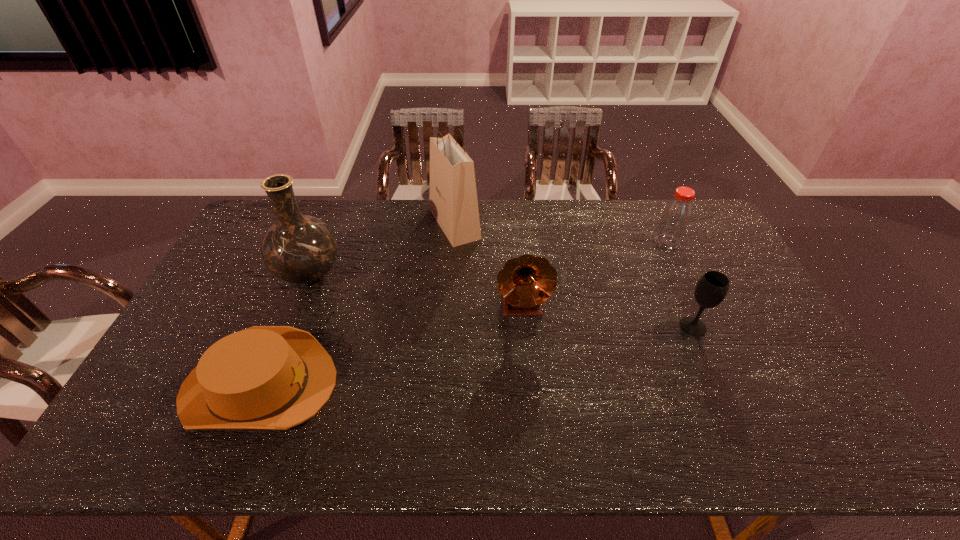
You are a GUI agent. You are given a task and a screenshot of the screen. Output one action in this format:
    pyautogui.click(x=<x>, y=<y>)
    Task: Click on the free location located 0.170m on the back of the bottle
    The width and height of the screenshot is (960, 540).
    Given the screenshot: What is the action you would take?
    pyautogui.click(x=650, y=207)

Identify the location of free space located 0.320m on the back of the wineglass. (658, 247).

Find the location of a particular element. Image resolution: width=960 pixels, height=540 pixels. vacant space located 0.290m on the front-facing side of the shortest object is located at coordinates (448, 385).

Where is `shopping bag present at the far edge`? The image size is (960, 540). shopping bag present at the far edge is located at coordinates (453, 202).

Find the location of a particular element. bottle located in the far edge section of the desktop is located at coordinates (675, 219).

This screenshot has width=960, height=540. I want to click on object located in the near edge section of the desktop, so click(264, 377).

The image size is (960, 540). I want to click on object that is at the left edge, so click(x=264, y=377).

The width and height of the screenshot is (960, 540). I want to click on object present at the right edge, so [675, 219].

Identify the location of object situated at the near left corner. This screenshot has width=960, height=540. (264, 377).

Locate an element on the screen. The width and height of the screenshot is (960, 540). object that is at the far right corner is located at coordinates (675, 219).